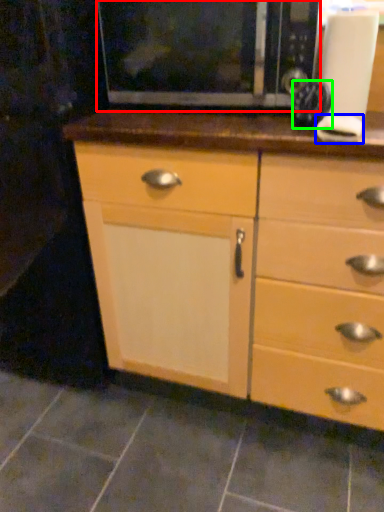
Question: Which object is positioned farthest from microwave (highlighted by a red box)? Select from knob (highlighted by a blue box) and appliance (highlighted by a green box).

Choices:
 (A) knob
 (B) appliance

Answer: (A)